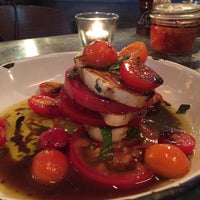
Where is `candle`? candle is located at coordinates (93, 36).